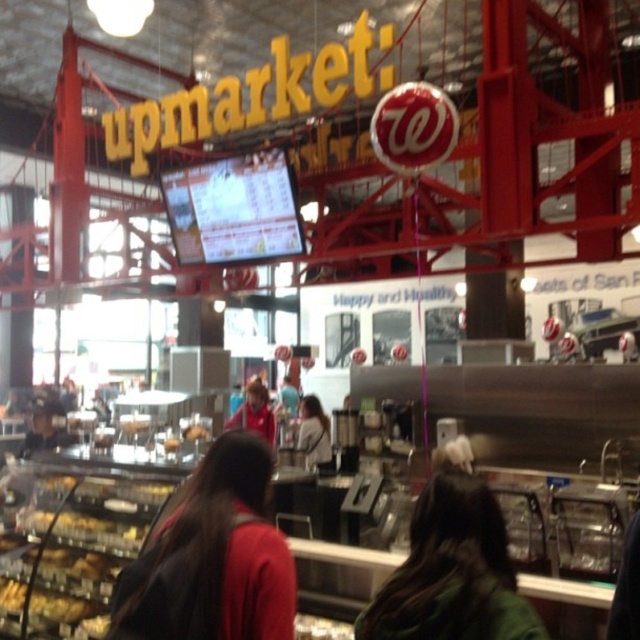
From the picture: You are a customer in the Walgreens Upmarket store and you see the dark brown leather jacket at center and the white fabric shirt at center. Which clothing item is closer to the ceiling?

The dark brown leather jacket at center is above the white fabric shirt at center, so it is closer to the ceiling.

You are standing at the entrance of the Walgreens Upmarket food court and want to approach the counter. There is a dark brown leather jacket at center. Which direction should you move to reach the counter?

The dark brown leather jacket at center is located at point (212, 557), so you should move towards the center area where the dark brown leather jacket at center is positioned to reach the counter.

You are a customer at the Walgreens Upmarket store and want to place an order at the counter. You notice the dark brown leather jacket at center and the green fabric at center. Which object is closer to the counter?

The dark brown leather jacket at center is located above the green fabric at center, so the green fabric at center is closer to the counter.